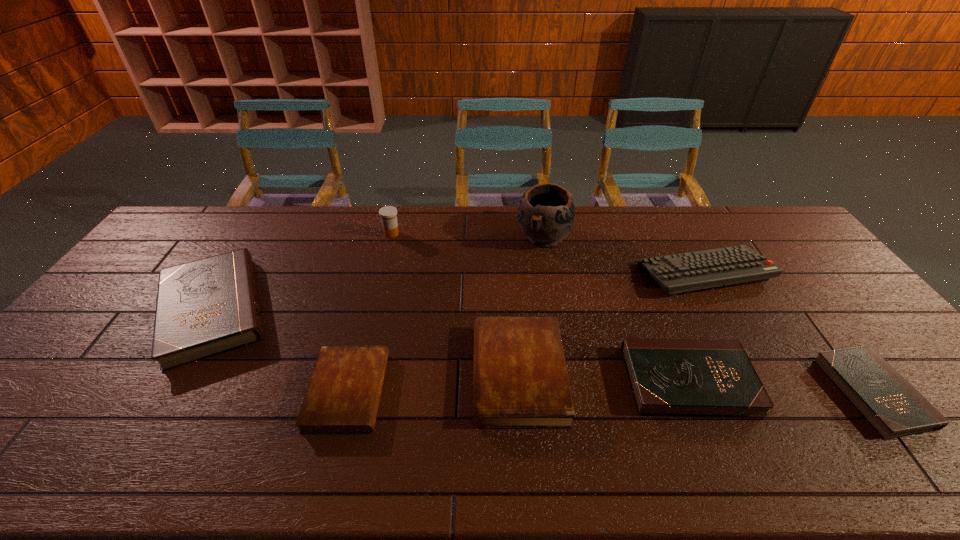
Locate an element on the screen. The image size is (960, 540). object present at the near right corner is located at coordinates (890, 404).

Where is `vacant space at the far edge`? The height and width of the screenshot is (540, 960). vacant space at the far edge is located at coordinates (306, 241).

You are a GUI agent. You are given a task and a screenshot of the screen. Output one action in this format:
    pyautogui.click(x=<x>, y=<y>)
    Task: Click on the free space at the near edge
    The width and height of the screenshot is (960, 540).
    Given the screenshot: What is the action you would take?
    pyautogui.click(x=662, y=475)

Identify the location of vacant position at the left edge of the desktop. (104, 354).

In the image, there is a desktop. Where is `vacant space at the right edge`? This screenshot has height=540, width=960. vacant space at the right edge is located at coordinates (800, 292).

Identify the location of free space at the far right corner. The width and height of the screenshot is (960, 540). (766, 212).

This screenshot has height=540, width=960. What are the coordinates of `free spot between the seventh shortest object and the second Bible from right to left` in the screenshot? It's located at [540, 307].

In order to click on free space between the computer keyboard and the second green Bible from right to left in this screenshot , I will do `click(697, 327)`.

This screenshot has width=960, height=540. I want to click on free spot between the computer keyboard and the seventh shortest object, so click(548, 253).

This screenshot has height=540, width=960. Identify the location of free space between the smallest green Bible and the left reddish-brown Bible. (611, 392).